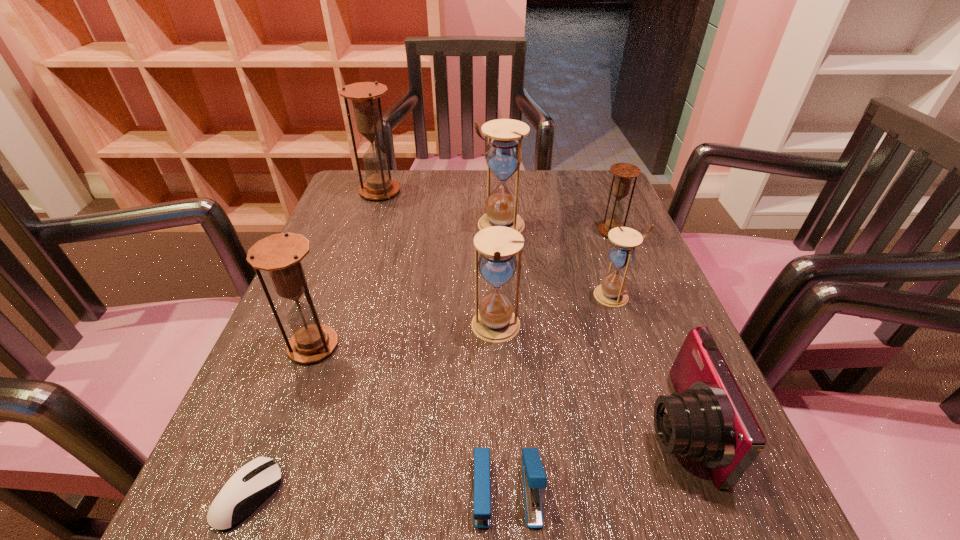
Locate an element on the screen. This screenshot has width=960, height=540. the sixth closest object to the eighth tallest object is located at coordinates (503, 155).

At what (x,y) coordinates should I click in order to perform the action: click on the second closest hourglass to the rightmost brown hourglass. Please return your answer as a coordinate pair (x, y). This screenshot has width=960, height=540. Looking at the image, I should click on (503, 155).

Identify which hourglass is the second closest to the seventh tallest object. Please provide its 2D coordinates. Your answer should be formatted as a tuple, i.e. [(x, y)], where the tuple contains the x and y coordinates of a point satisfying the conditions above.

[(495, 322)]

Locate which brown hourglass is the closest to the second farthest brown hourglass. Please provide its 2D coordinates. Your answer should be formatted as a tuple, i.e. [(x, y)], where the tuple contains the x and y coordinates of a point satisfying the conditions above.

[(365, 96)]

Where is `the second closest brown hourglass to the smallest brown hourglass`? the second closest brown hourglass to the smallest brown hourglass is located at coordinates pos(281,254).

Locate an element on the screen. The width and height of the screenshot is (960, 540). white hourglass identified as the closest to the second farthest brown hourglass is located at coordinates (612, 292).

Identify which white hourglass is located as the second nearest to the second biggest white hourglass. Please provide its 2D coordinates. Your answer should be formatted as a tuple, i.e. [(x, y)], where the tuple contains the x and y coordinates of a point satisfying the conditions above.

[(503, 155)]

Identify the location of vacant region that satisfies the following two spatial constraints: 1. on the back side of the biggest white hourglass; 2. on the left side of the second smallest white hourglass. This screenshot has width=960, height=540. (492, 225).

Where is `free point that satisfies the following two spatial constraints: 1. on the front side of the smallest brown hourglass; 2. on the left side of the farthest white hourglass`? free point that satisfies the following two spatial constraints: 1. on the front side of the smallest brown hourglass; 2. on the left side of the farthest white hourglass is located at coordinates (500, 231).

Locate an element on the screen. This screenshot has height=540, width=960. vacant point that satisfies the following two spatial constraints: 1. on the back side of the second farthest brown hourglass; 2. on the right side of the blue stapler is located at coordinates (495, 231).